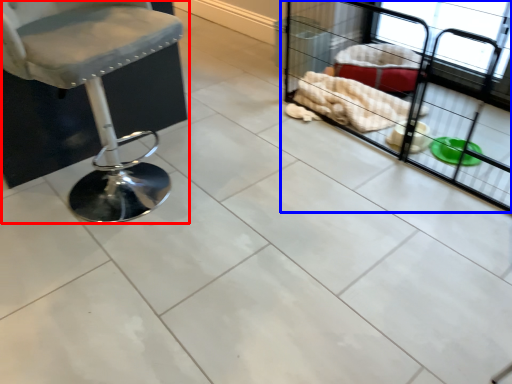
Question: Which point is closer to the camera, chair (highlighted by a red box) or baby carriage (highlighted by a blue box)?

Choices:
 (A) chair
 (B) baby carriage

Answer: (A)